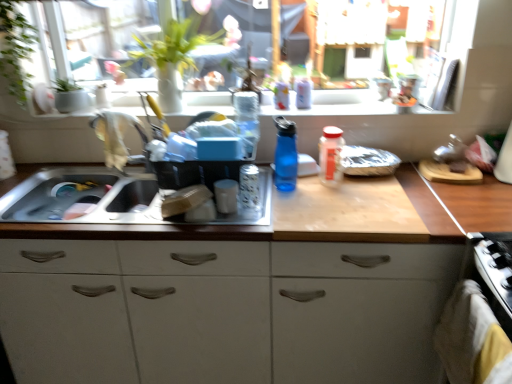
This screenshot has width=512, height=384. Find the location of `free space in front of translucent glass jar at sink, arranged as the fifth bottle when viewed from the right`. free space in front of translucent glass jar at sink, arranged as the fifth bottle when viewed from the right is located at coordinates (250, 219).